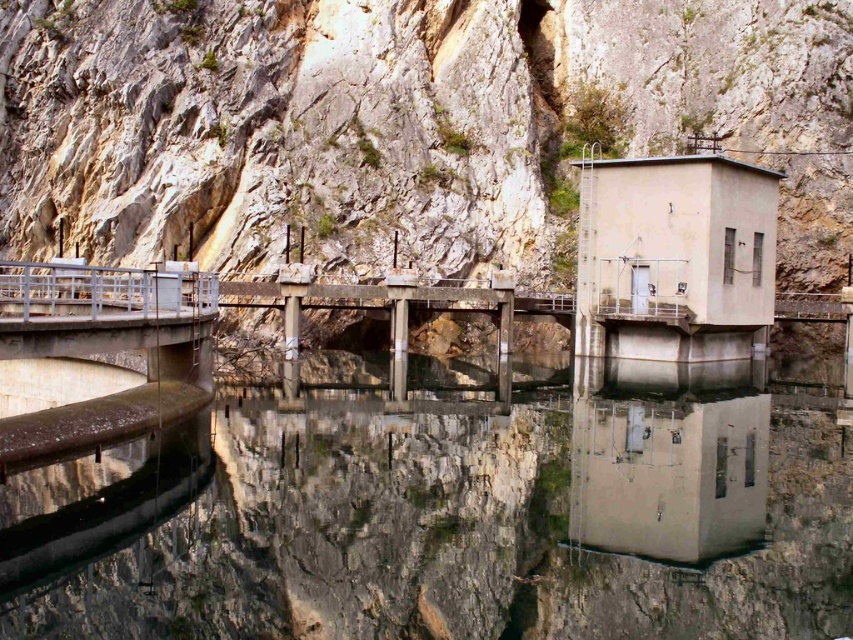
Between transparent concrete river at center and rough stone mountain at upper left, which one is positioned lower?

Positioned lower is transparent concrete river at center.

Looking at this image, which of these two, transparent concrete river at center or rough stone mountain at upper left, stands taller?

With more height is rough stone mountain at upper left.

What are the coordinates of `transparent concrete river at center` in the screenshot? It's located at (456, 513).